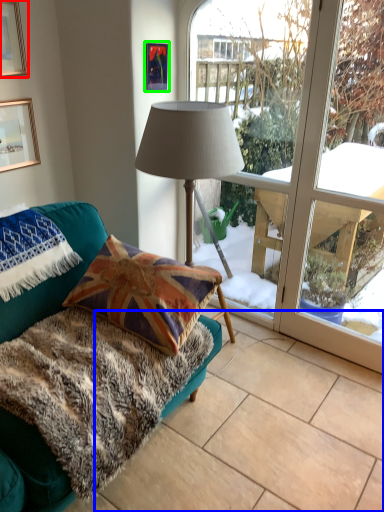
Question: Based on their relative distances, which object is nearer to picture frame (highlighted by a red box)? Choose from tile (highlighted by a blue box) and picture frame (highlighted by a green box).

Choices:
 (A) tile
 (B) picture frame

Answer: (B)